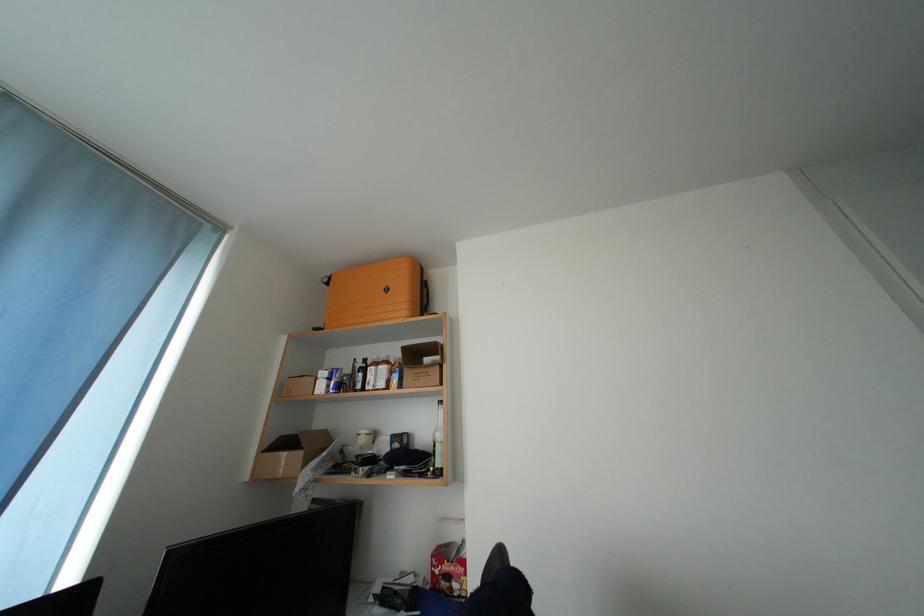
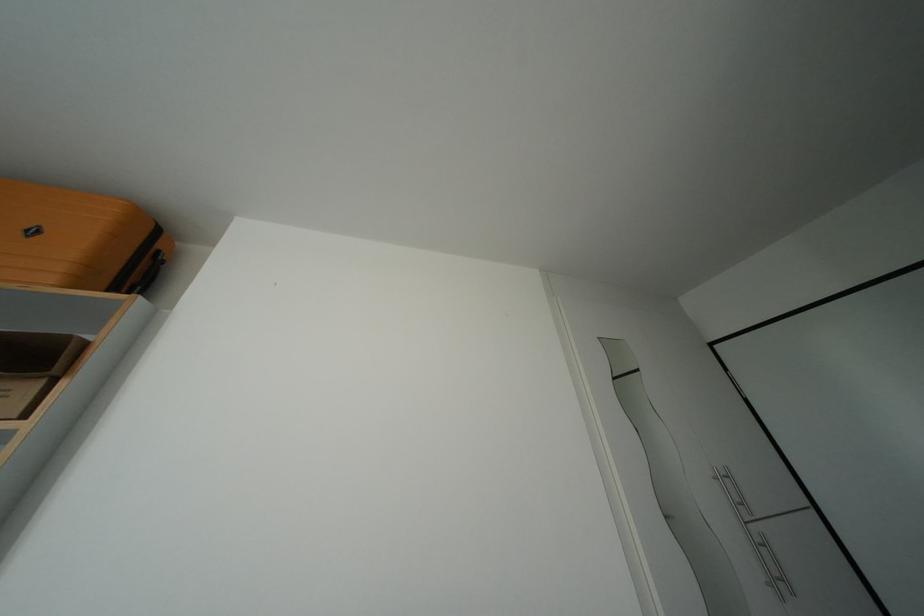
The point at (444, 347) is marked in the first image. Where is the corresponding point in the second image?

(76, 342)